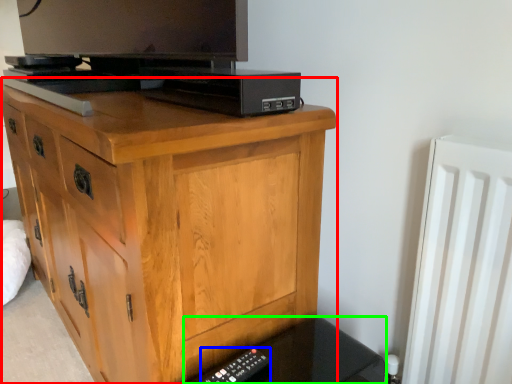
Question: Considering the real-world distances, which object is closest to chest of drawers (highlighted by a red box)? remote (highlighted by a blue box) or vanity (highlighted by a green box).

Choices:
 (A) remote
 (B) vanity

Answer: (B)